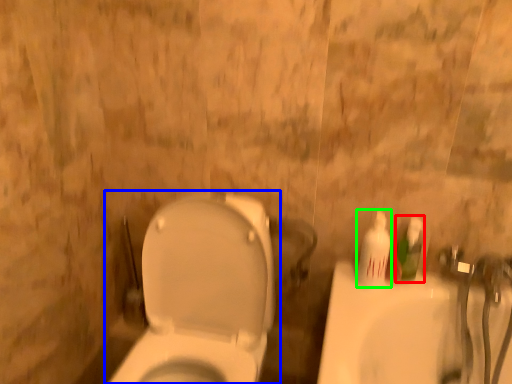
Question: Which is farther away from mouthwash (highlighted by a red box)? toilet (highlighted by a blue box) or mouthwash (highlighted by a green box)?

Choices:
 (A) toilet
 (B) mouthwash

Answer: (A)